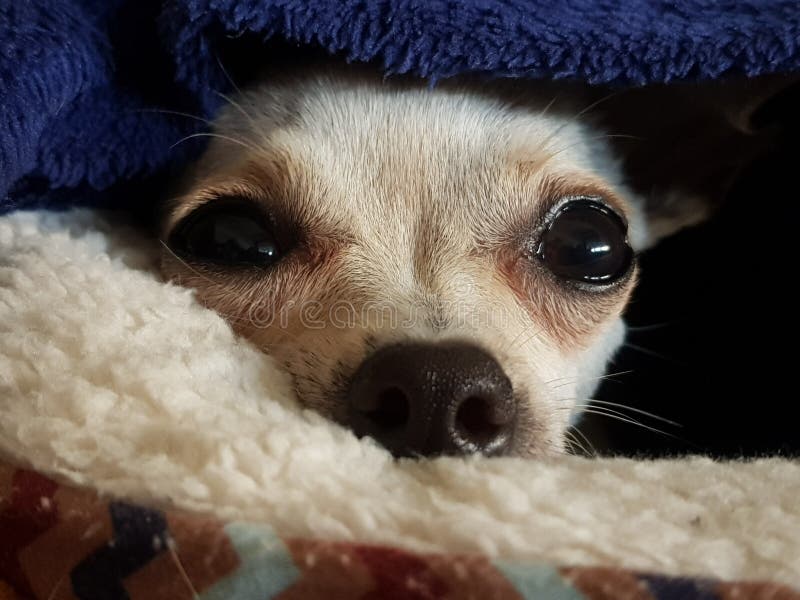
Locate an element on the screen. This screenshot has width=800, height=600. blue blanket is located at coordinates (350, 37).